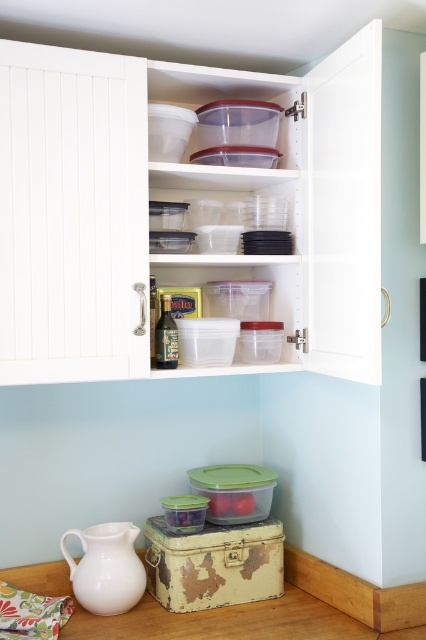
Question: Is clear plastic containers at upper center below white matte jug at lower left?

Choices:
 (A) no
 (B) yes

Answer: (A)

Question: Among these objects, which one is nearest to the camera?

Choices:
 (A) white matte jug at lower left
 (B) clear plastic containers at upper center

Answer: (B)

Question: Does clear plastic containers at upper center appear on the right side of white matte jug at lower left?

Choices:
 (A) yes
 (B) no

Answer: (A)

Question: From the image, what is the correct spatial relationship of clear plastic containers at upper center in relation to white matte jug at lower left?

Choices:
 (A) right
 (B) left

Answer: (A)

Question: Which point is farther to the camera?

Choices:
 (A) white matte jug at lower left
 (B) clear plastic containers at upper center

Answer: (A)